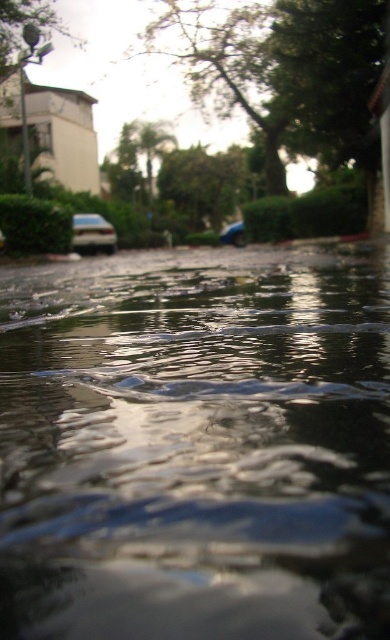
You are a delivery person trying to cross the street to deliver a package. You see the transparent liquid at center and the metallic silver car at lower left. Which object is lower in height from the ground?

The transparent liquid at center is shorter than the metallic silver car at lower left, so the transparent liquid at center is lower in height from the ground.

You are standing on the street and want to cross to the other side. There is a transparent liquid at center and a metallic blue car at center in your way. Which object should you avoid stepping on to stay dry?

You should avoid stepping on the transparent liquid at center because it is a liquid and could make you wet, while the metallic blue car at center is a solid object and safe to walk around.